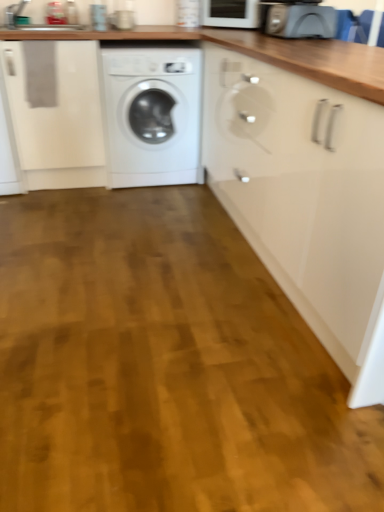
Question: In terms of width, does glossy white cabinet at center look wider or thinner when compared to white glossy washing machine at center?

Choices:
 (A) thin
 (B) wide

Answer: (A)

Question: In terms of size, does glossy white cabinet at center appear bigger or smaller than white glossy washing machine at center?

Choices:
 (A) big
 (B) small

Answer: (A)

Question: Estimate the real-world distances between objects in this image. Which object is farther from the white glossy microwave at upper center, the 1th appliance when ordered from top to bottom?

Choices:
 (A) glossy white cabinet at center
 (B) white glossy washing machine at center
 (C) wooden counter at upper center
 (D) wooden floor at center
 (E) matte gray toaster at upper right, marked as the 2th appliance in a top-to-bottom arrangement

Answer: (D)

Question: Estimate the real-world distances between objects in this image. Which object is farther from the wooden counter at upper center?

Choices:
 (A) wooden floor at center
 (B) glossy white cabinet at center
 (C) matte gray toaster at upper right, marked as the first appliance in a front-to-back arrangement
 (D) white glossy microwave at upper center, positioned as the first appliance in back-to-front order
 (E) white glossy washing machine at center

Answer: (D)